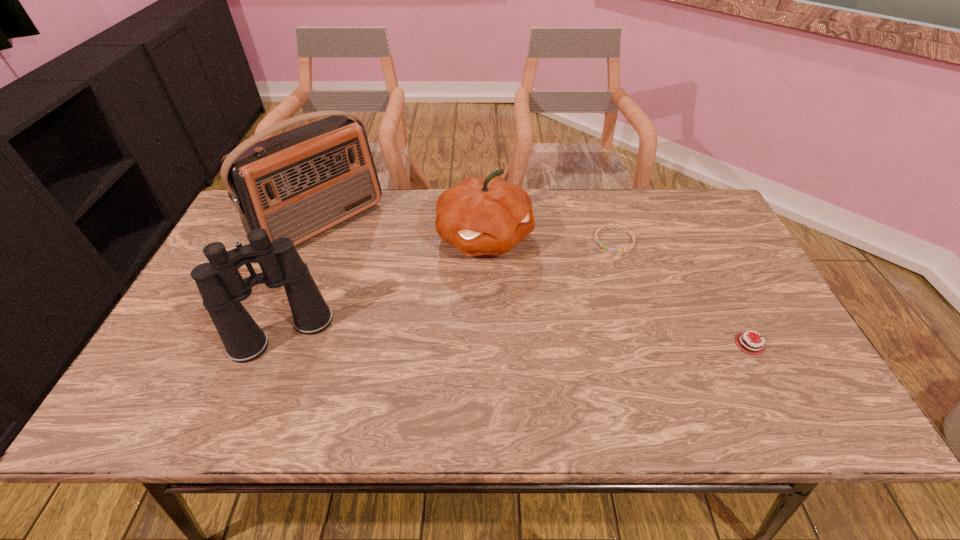
Identify the location of binoculars. This screenshot has height=540, width=960. (222, 288).

Find the location of a particular element. the rightmost object is located at coordinates (757, 349).

What are the coordinates of `chocolate cake` in the screenshot? It's located at (757, 349).

Identify the location of the third shortest object. (479, 216).

This screenshot has width=960, height=540. I want to click on pumpkin, so click(x=479, y=216).

I want to click on the shortest object, so click(605, 247).

Where is `bracelet`? The width and height of the screenshot is (960, 540). bracelet is located at coordinates (605, 247).

Locate an element on the screen. This screenshot has width=960, height=540. radio receiver is located at coordinates (299, 183).

Where is `vacant space located on the right of the binoculars`? The image size is (960, 540). vacant space located on the right of the binoculars is located at coordinates (449, 334).

This screenshot has width=960, height=540. I want to click on blank space located on the left of the chocolate cake, so click(571, 345).